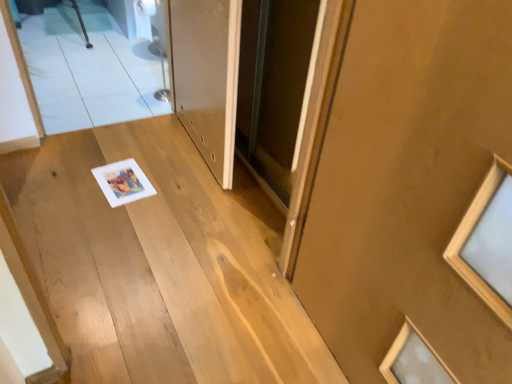
Image resolution: width=512 pixels, height=384 pixels. What are the coordinates of `vacant location below white glossy door at center, which is the 1th door from back to front (from a real-world perspective)` in the screenshot? It's located at (192, 154).